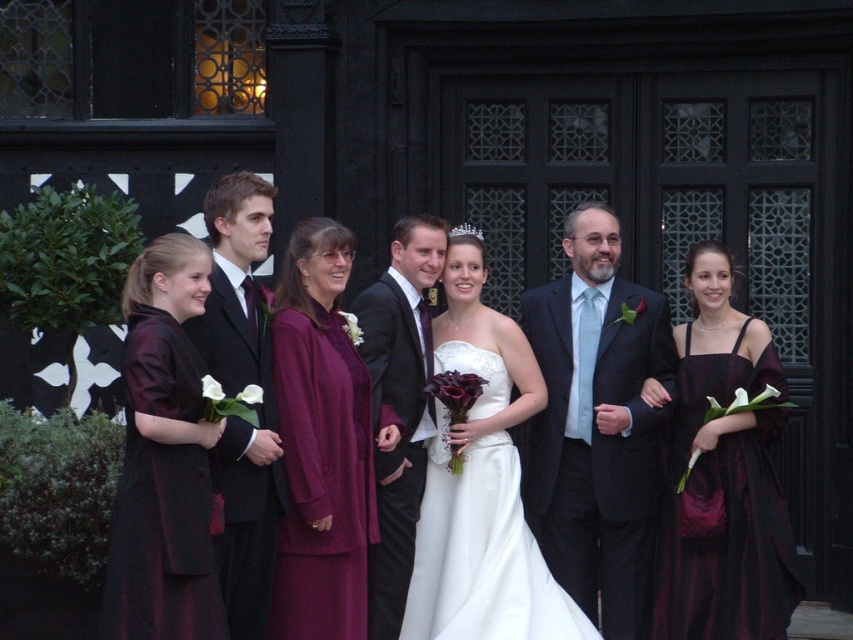
Question: Which point is closer to the camera taking this photo?

Choices:
 (A) (386, 524)
 (B) (767, 579)

Answer: (B)

Question: Considering the relative positions of matte burgundy dress at center and white satin dress at center in the image provided, where is matte burgundy dress at center located with respect to white satin dress at center?

Choices:
 (A) right
 (B) left

Answer: (A)

Question: Which point is closer to the camera?

Choices:
 (A) velvet burgundy dress at left
 (B) burgundy satin dress at center

Answer: (A)

Question: Which point is closer to the camera?

Choices:
 (A) (194, 576)
 (B) (409, 308)
 (C) (602, 612)
 (D) (532, 516)

Answer: (A)

Question: In this image, where is matte black suit at center located relative to shiny black suit at center?

Choices:
 (A) left
 (B) right

Answer: (B)

Question: Is burgundy satin dress at center below shiny black suit at left?

Choices:
 (A) no
 (B) yes

Answer: (B)